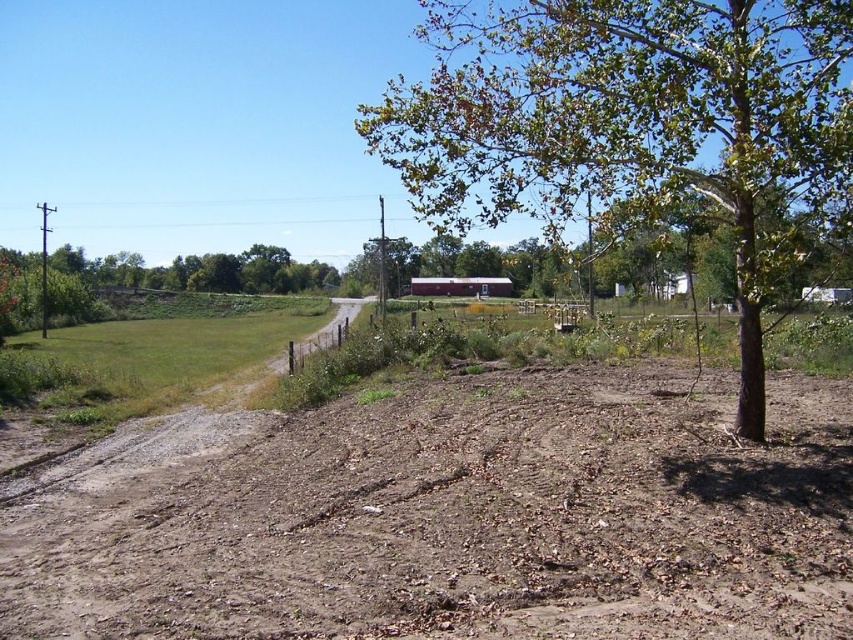
Who is more distant from viewer, (682, 602) or (718, 52)?

Positioned behind is point (718, 52).

The image size is (853, 640). Describe the element at coordinates (450, 516) in the screenshot. I see `brown soil at lower center` at that location.

Which is behind, point (379, 596) or point (834, 35)?

Point (834, 35)

The width and height of the screenshot is (853, 640). Identify the location of brown soil at lower center. (450, 516).